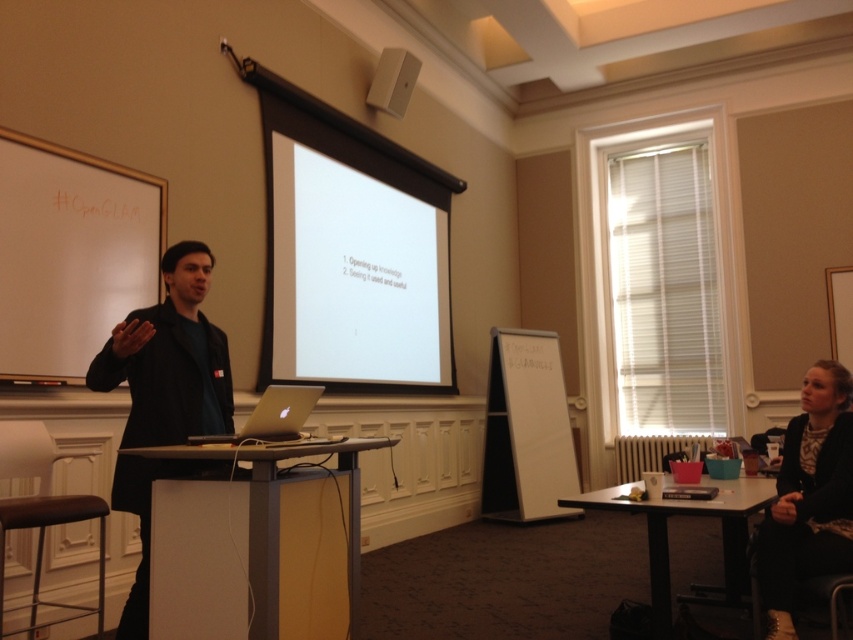
You are an attendee at the conference and you want to place your bag on the nearest surface. You see the black textured sweater at lower right and the matte plastic table at lower right. Which one is closer to you?

The matte plastic table at lower right is closer to you because the black textured sweater at lower right is to the right of it, meaning the table is positioned further away from your perspective.

You are an attendee at the presentation and want to place a notebook on the nearest surface. Which object between the black textured sweater at lower right and the matte plastic table at lower right should you choose?

The matte plastic table at lower right is behind the black textured sweater at lower right, so you should choose the black textured sweater at lower right as it is closer to you.